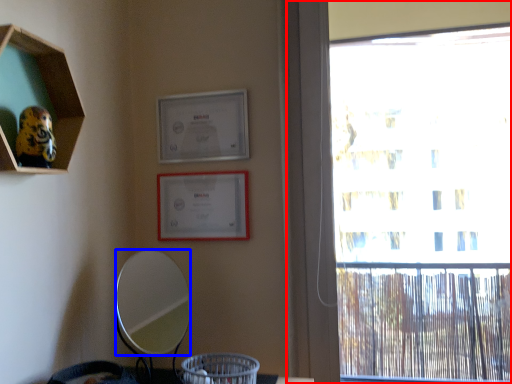
Question: Among these objects, which one is farthest to the camera, window (highlighted by a red box) or mirror (highlighted by a blue box)?

Choices:
 (A) window
 (B) mirror

Answer: (A)